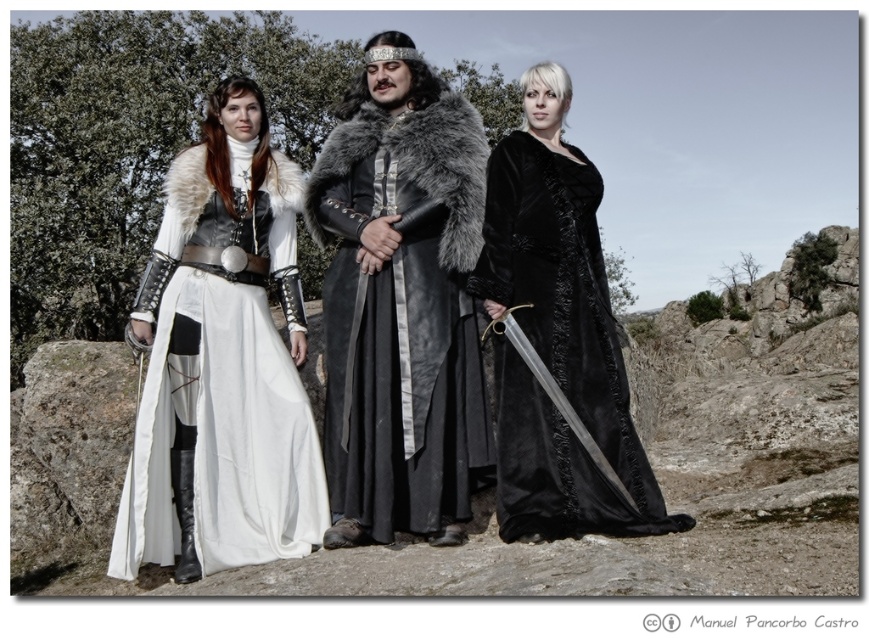
From the picture: Can you confirm if leather fur-trimmed cloak at center is shorter than polished silver sword at center?

No, leather fur-trimmed cloak at center is not shorter than polished silver sword at center.

Does leather fur-trimmed cloak at center have a larger size compared to polished silver sword at center?

Correct, leather fur-trimmed cloak at center is larger in size than polished silver sword at center.

Between point (435, 124) and point (581, 428), which one is positioned in front?

Point (581, 428)

Locate an element on the screen. The height and width of the screenshot is (640, 869). leather fur-trimmed cloak at center is located at coordinates (401, 305).

Image resolution: width=869 pixels, height=640 pixels. I want to click on velvet black dress at center, so click(556, 337).

The width and height of the screenshot is (869, 640). I want to click on velvet black dress at center, so click(556, 337).

Does white matte fabric dress at left have a lesser height compared to velvet black dress at center?

No, white matte fabric dress at left is not shorter than velvet black dress at center.

Does white matte fabric dress at left appear under velvet black dress at center?

A: Yes, white matte fabric dress at left is below velvet black dress at center.

Is point (203, 346) positioned in front of point (523, 232)?

Yes, it is.

Where is `white matte fabric dress at left`? This screenshot has height=640, width=869. white matte fabric dress at left is located at coordinates (222, 364).